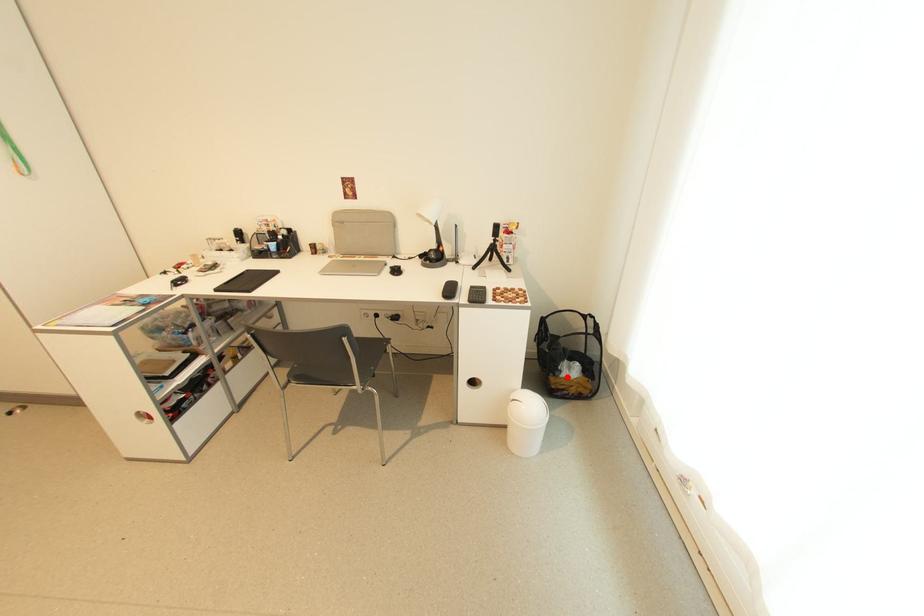
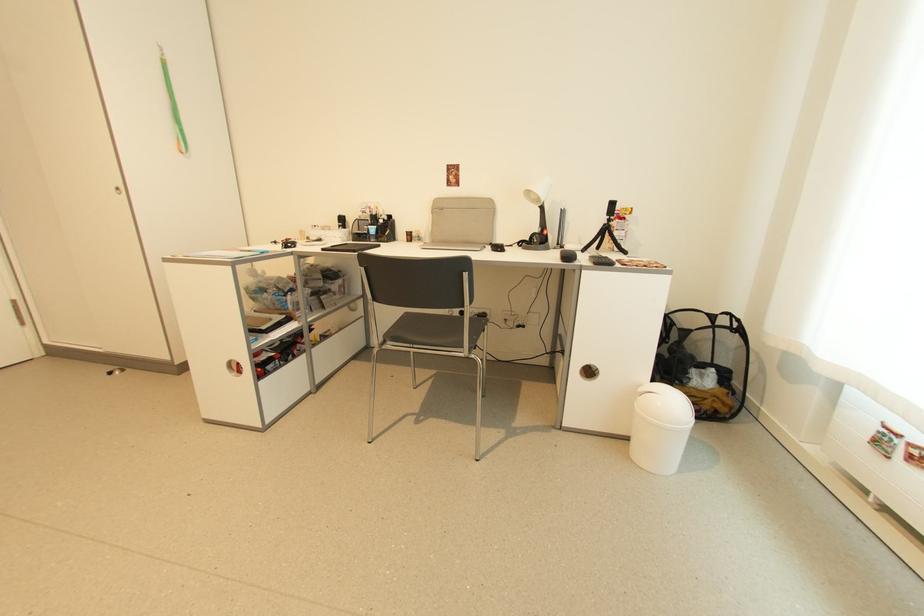
Where in the second image is the point corresponding to the highlighted location from the first image?

(697, 386)